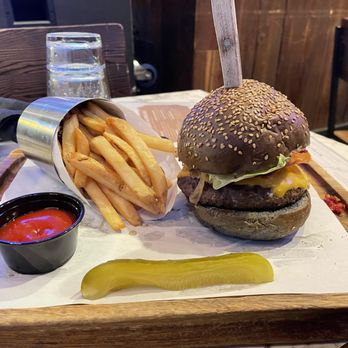
Find the location of a particular element. knife handle is located at coordinates (233, 58).